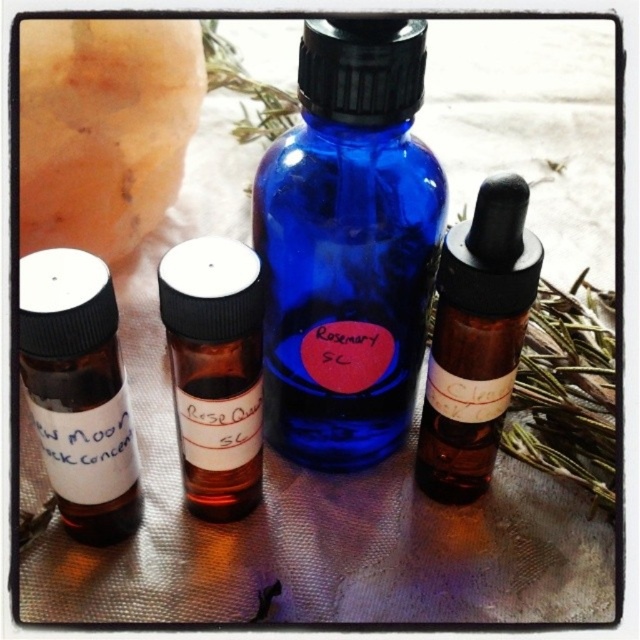
Does blue glass bottle at center lie in front of brown glass dropper bottle at right?

Yes, blue glass bottle at center is in front of brown glass dropper bottle at right.

In the scene shown: Can you confirm if blue glass bottle at center is positioned below brown glass dropper bottle at right?

No.

Measure the distance between point (348, 429) and camera.

Point (348, 429) and camera are 39.34 inches apart.

Find the location of a particular element. This screenshot has height=640, width=640. blue glass bottle at center is located at coordinates 348,244.

Is point (417, 285) positioned in front of point (48, 312)?

No.

Does blue glass bottle at center appear on the right side of white matte vial at left?

Indeed, blue glass bottle at center is positioned on the right side of white matte vial at left.

Find the location of a particular element. blue glass bottle at center is located at coordinates (348, 244).

What are the coordinates of `amber glass vial at center` in the screenshot? It's located at (216, 371).

I want to click on amber glass vial at center, so click(216, 371).

Identify the location of amber glass vial at center. (216, 371).